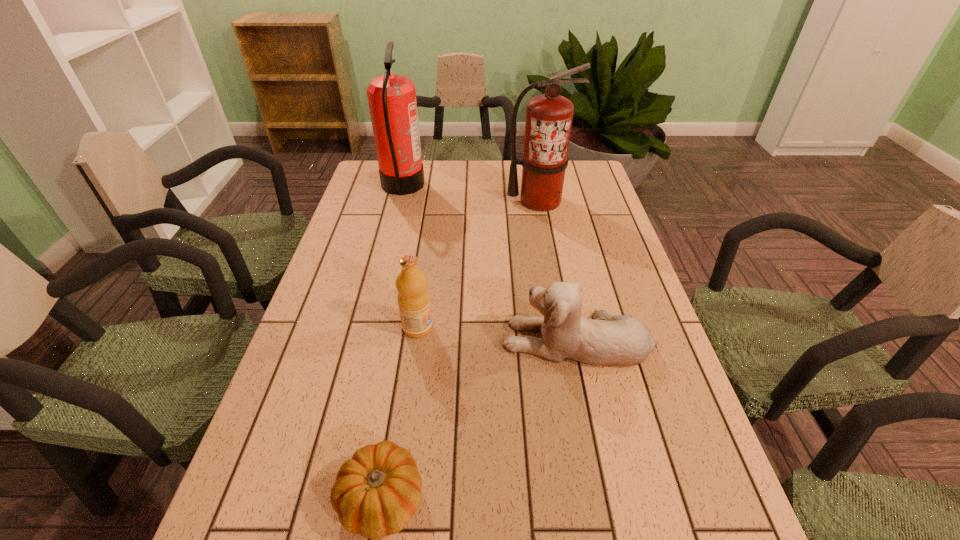
This screenshot has height=540, width=960. Find the location of `blank region between the right fire extinguisher and the puppy`. blank region between the right fire extinguisher and the puppy is located at coordinates (558, 271).

Identify the location of vacant area between the right fire extinguisher and the left fire extinguisher. The height and width of the screenshot is (540, 960). (470, 193).

At what (x,y) coordinates should I click in order to perform the action: click on object that ranks as the closest to the fourth tallest object. Please return your answer as a coordinate pair (x, y). Looking at the image, I should click on (413, 297).

Select which object appears as the third closest to the shortest object. Please provide its 2D coordinates. Your answer should be formatted as a tuple, i.e. [(x, y)], where the tuple contains the x and y coordinates of a point satisfying the conditions above.

[(549, 116)]

Identify the location of blank area in the image that satisfies the following two spatial constraints: 1. toward the nozzle of the right fire extinguisher; 2. on the front label of the third tallest object. (562, 328).